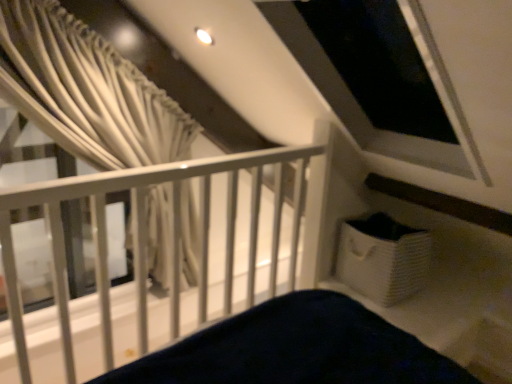
Question: Is white fabric curtain at upper left in front of white matte rail at upper left?

Choices:
 (A) no
 (B) yes

Answer: (A)

Question: Is white fabric curtain at upper left positioned beyond the bounds of white matte rail at upper left?

Choices:
 (A) no
 (B) yes

Answer: (B)

Question: Does white fabric curtain at upper left have a greater width compared to white matte rail at upper left?

Choices:
 (A) no
 (B) yes

Answer: (A)

Question: Is white fabric curtain at upper left facing towards white matte rail at upper left?

Choices:
 (A) no
 (B) yes

Answer: (A)

Question: From a real-world perspective, does white fabric curtain at upper left stand above white matte rail at upper left?

Choices:
 (A) no
 (B) yes

Answer: (B)

Question: Can you confirm if white fabric curtain at upper left is positioned to the left of white matte rail at upper left?

Choices:
 (A) yes
 (B) no

Answer: (A)

Question: Is white matte rail at upper left not near white fabric curtain at upper left?

Choices:
 (A) yes
 (B) no

Answer: (B)

Question: Is white matte rail at upper left bigger than white fabric curtain at upper left?

Choices:
 (A) yes
 (B) no

Answer: (A)

Question: Considering the relative sizes of white matte rail at upper left and white fabric curtain at upper left in the image provided, is white matte rail at upper left thinner than white fabric curtain at upper left?

Choices:
 (A) yes
 (B) no

Answer: (B)

Question: From a real-world perspective, is white matte rail at upper left physically above white fabric curtain at upper left?

Choices:
 (A) yes
 (B) no

Answer: (B)

Question: Is white matte rail at upper left facing away from white fabric curtain at upper left?

Choices:
 (A) yes
 (B) no

Answer: (B)

Question: Is white matte rail at upper left positioned before white fabric curtain at upper left?

Choices:
 (A) yes
 (B) no

Answer: (A)

Question: From a real-world perspective, is white matte rail at upper left above or below white fabric curtain at upper left?

Choices:
 (A) below
 (B) above

Answer: (A)